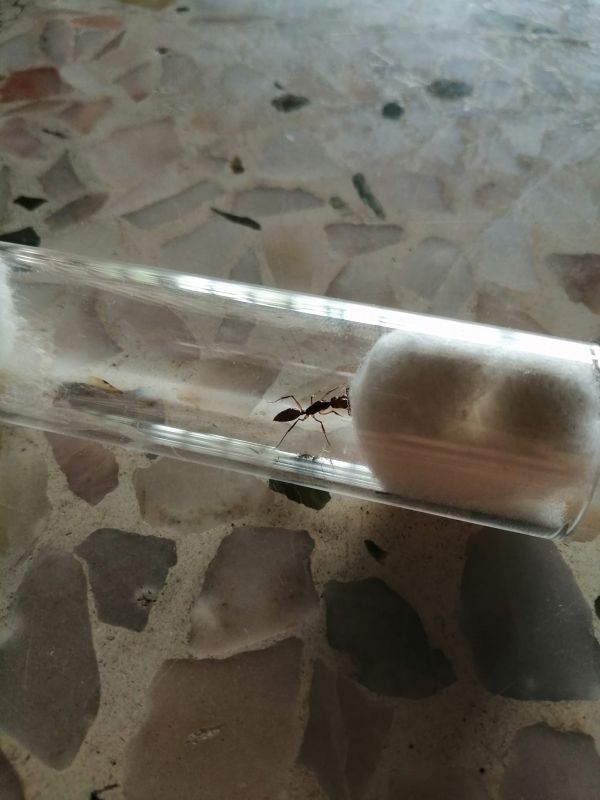
Locate an element on the screen. The height and width of the screenshot is (800, 600). grout is located at coordinates (200, 214), (327, 541), (135, 660).